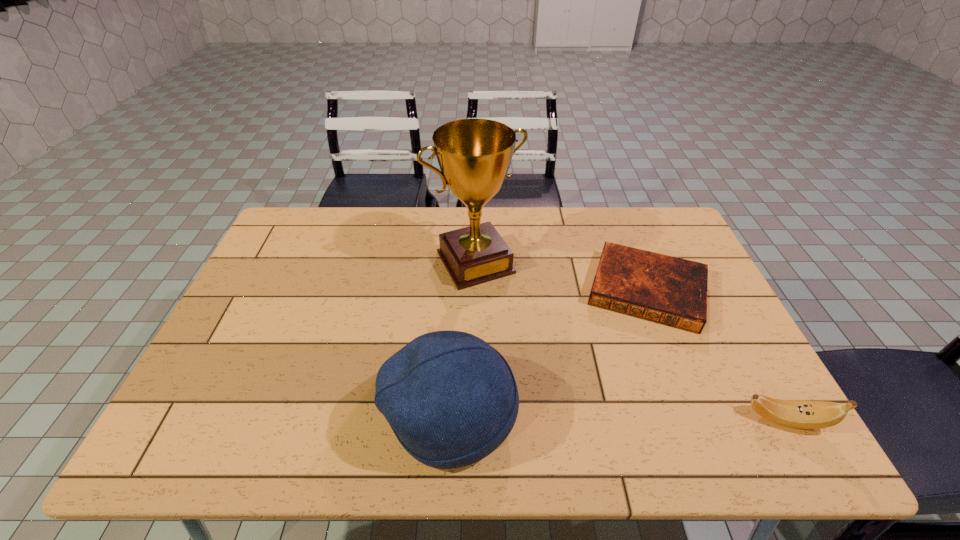
What are the coordinates of `the third closest object relative to the skullcap` in the screenshot? It's located at coord(798,414).

Locate an element on the screen. object that can be found as the second closest to the third tallest object is located at coordinates (451, 399).

Where is `vacant area in the image that satisfies the following two spatial constraints: 1. on the front side of the banana; 2. on the left side of the skullcap`? The width and height of the screenshot is (960, 540). vacant area in the image that satisfies the following two spatial constraints: 1. on the front side of the banana; 2. on the left side of the skullcap is located at coordinates (451, 420).

Find the location of `free space in the image that satisfies the following two spatial constraints: 1. on the back side of the skullcap; 2. on the right side of the tallest object`. free space in the image that satisfies the following two spatial constraints: 1. on the back side of the skullcap; 2. on the right side of the tallest object is located at coordinates (460, 262).

This screenshot has height=540, width=960. Find the location of `vacant space that satisfies the following two spatial constraints: 1. on the front side of the Bible; 2. on the right side of the tallest object`. vacant space that satisfies the following two spatial constraints: 1. on the front side of the Bible; 2. on the right side of the tallest object is located at coordinates (475, 291).

I want to click on vacant space that satisfies the following two spatial constraints: 1. on the front side of the Bible; 2. on the left side of the tallest object, so click(x=475, y=291).

At what (x,y) coordinates should I click in order to perform the action: click on free space in the image that satisfies the following two spatial constraints: 1. on the back side of the third shortest object; 2. on the right side of the shortest object. Please return your answer as a coordinate pair (x, y). Looking at the image, I should click on (458, 291).